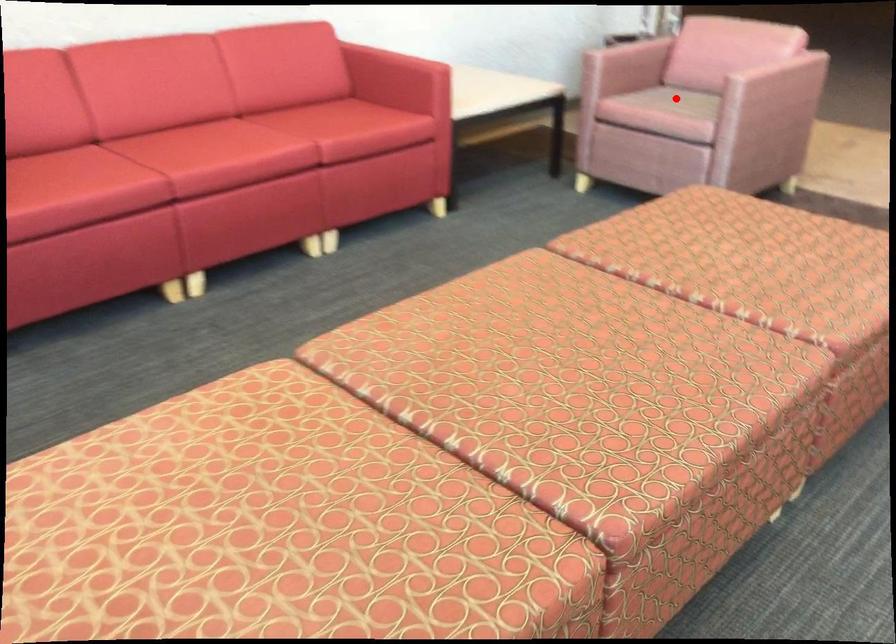
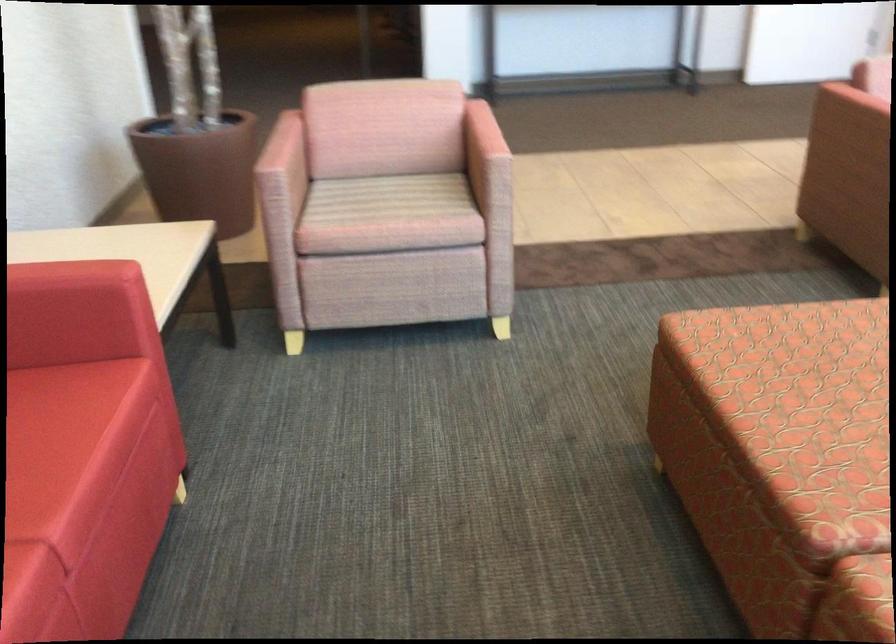
Locate, in the second image, the point that corresponds to the highlighted location in the first image.

(389, 198)